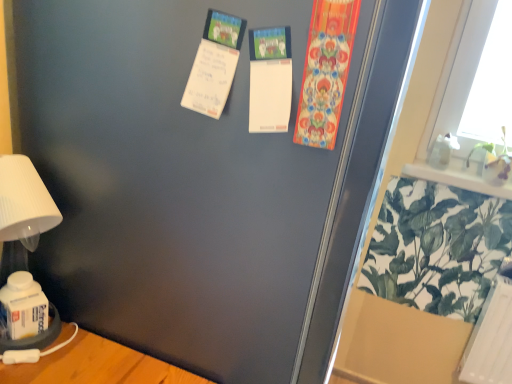
Describe the element at coordinates (437, 247) in the screenshot. The width and height of the screenshot is (512, 384). I see `green leafy plant at lower right, the second plant when ordered from top to bottom` at that location.

The width and height of the screenshot is (512, 384). What do you see at coordinates (326, 71) in the screenshot?
I see `colorful fabric banner at upper right, which is counted as the second postcard, starting from the left` at bounding box center [326, 71].

Find the location of a particular element. Image resolution: width=512 pixels, height=384 pixels. white matte table lamp at lower left is located at coordinates (22, 244).

Find the location of `white paper postcard at upper center, placed as the second postcard when sorted from right to left`. white paper postcard at upper center, placed as the second postcard when sorted from right to left is located at coordinates (210, 79).

Locate an element on the screen. green leafy plant at lower right, the second plant when ordered from top to bottom is located at coordinates (437, 247).

Could you tell me if white paper postcard at upper center, which is the first postcard from left to right, is turned towards green leafy plant at upper right, which appears as the 2th plant when ordered from the bottom?

No, white paper postcard at upper center, which is the first postcard from left to right, is not facing towards green leafy plant at upper right, which appears as the 2th plant when ordered from the bottom.

Based on their sizes in the image, would you say white paper postcard at upper center, placed as the second postcard when sorted from right to left, is bigger or smaller than green leafy plant at upper right, which appears as the 2th plant when ordered from the bottom?

Clearly, white paper postcard at upper center, placed as the second postcard when sorted from right to left, is smaller in size than green leafy plant at upper right, which appears as the 2th plant when ordered from the bottom.

Identify the location of the 2nd plant to the right of the white paper postcard at upper center, placed as the second postcard when sorted from right to left, starting your count from the anchor. (494, 161).

Is point (220, 105) farther from camera compared to point (490, 157)?

That is False.

Is point (349, 54) positioned in front of point (42, 181)?

That is True.

From a real-world perspective, which postcard is the 2nd one above the white matte table lamp at lower left? Please provide its 2D coordinates.

[(326, 71)]

Between colorful fabric banner at upper right, which ranks as the first postcard in right-to-left order, and white matte table lamp at lower left, which one has smaller size?

colorful fabric banner at upper right, which ranks as the first postcard in right-to-left order, is smaller.

From a real-world perspective, is colorful fabric banner at upper right, which ranks as the first postcard in right-to-left order, located higher than white matte table lamp at lower left?

Yes.

Is white matte table lamp at lower left turned away from green leafy plant at upper right, which ranks as the 1th plant in top-to-bottom order?

No.

Are white matte table lamp at lower left and green leafy plant at upper right, which ranks as the 1th plant in top-to-bottom order, making contact?

white matte table lamp at lower left and green leafy plant at upper right, which ranks as the 1th plant in top-to-bottom order, are not in contact.

Considering the sizes of white matte table lamp at lower left and green leafy plant at upper right, which appears as the 2th plant when ordered from the bottom, in the image, is white matte table lamp at lower left taller or shorter than green leafy plant at upper right, which appears as the 2th plant when ordered from the bottom,?

Considering their sizes, white matte table lamp at lower left has more height than green leafy plant at upper right, which appears as the 2th plant when ordered from the bottom.

Does point (49, 203) come in front of point (503, 160)?

Yes, it is.

Is green leafy plant at upper right, which ranks as the 1th plant in top-to-bottom order, positioned with its back to green leafy plant at lower right, the first plant when ordered from bottom to top?

No, green leafy plant at upper right, which ranks as the 1th plant in top-to-bottom order, is not facing the opposite direction of green leafy plant at lower right, the first plant when ordered from bottom to top.

Would you say green leafy plant at upper right, which ranks as the 1th plant in top-to-bottom order, is a long distance from green leafy plant at lower right, the first plant when ordered from bottom to top?

Actually, green leafy plant at upper right, which ranks as the 1th plant in top-to-bottom order, and green leafy plant at lower right, the first plant when ordered from bottom to top, are a little close together.

In the scene shown: Considering the relative sizes of green leafy plant at upper right, which appears as the 2th plant when ordered from the bottom, and green leafy plant at lower right, the first plant when ordered from bottom to top, in the image provided, is green leafy plant at upper right, which appears as the 2th plant when ordered from the bottom, smaller than green leafy plant at lower right, the first plant when ordered from bottom to top,?

Correct, green leafy plant at upper right, which appears as the 2th plant when ordered from the bottom, occupies less space than green leafy plant at lower right, the first plant when ordered from bottom to top.

Is green leafy plant at upper right, which appears as the 2th plant when ordered from the bottom, taller or shorter than green leafy plant at lower right, the second plant when ordered from top to bottom?

In the image, green leafy plant at upper right, which appears as the 2th plant when ordered from the bottom, appears to be shorter than green leafy plant at lower right, the second plant when ordered from top to bottom.

Does point (185, 89) appear closer or farther from the camera than point (452, 243)?

Point (185, 89) is positioned closer to the camera compared to point (452, 243).

Is white paper postcard at upper center, placed as the second postcard when sorted from right to left, next to green leafy plant at lower right, the first plant when ordered from bottom to top?

No, white paper postcard at upper center, placed as the second postcard when sorted from right to left, is not in contact with green leafy plant at lower right, the first plant when ordered from bottom to top.

Looking at this image, is transparent plastic screen door at upper right facing away from colorful fabric banner at upper right, which ranks as the first postcard in right-to-left order?

That's not correct — transparent plastic screen door at upper right is not looking away from colorful fabric banner at upper right, which ranks as the first postcard in right-to-left order.

From a real-world perspective, is transparent plastic screen door at upper right located higher than colorful fabric banner at upper right, which is counted as the second postcard, starting from the left?

Incorrect, from a real-world perspective, transparent plastic screen door at upper right is lower than colorful fabric banner at upper right, which is counted as the second postcard, starting from the left.

What's the angular difference between transparent plastic screen door at upper right and colorful fabric banner at upper right, which is counted as the second postcard, starting from the left,'s facing directions?

90.5 degrees separate the facing orientations of transparent plastic screen door at upper right and colorful fabric banner at upper right, which is counted as the second postcard, starting from the left.

Between transparent plastic screen door at upper right and colorful fabric banner at upper right, which ranks as the first postcard in right-to-left order, which one is positioned behind?

Positioned behind is colorful fabric banner at upper right, which ranks as the first postcard in right-to-left order.

Consider the image. From the image's perspective, is white paper postcard at upper center, which is the first postcard from left to right, under colorful fabric banner at upper right, which is counted as the second postcard, starting from the left?

No, from the image's perspective, white paper postcard at upper center, which is the first postcard from left to right, is not beneath colorful fabric banner at upper right, which is counted as the second postcard, starting from the left.

Considering the sizes of white paper postcard at upper center, placed as the second postcard when sorted from right to left, and colorful fabric banner at upper right, which ranks as the first postcard in right-to-left order, in the image, is white paper postcard at upper center, placed as the second postcard when sorted from right to left, bigger or smaller than colorful fabric banner at upper right, which ranks as the first postcard in right-to-left order,?

Clearly, white paper postcard at upper center, placed as the second postcard when sorted from right to left, is larger in size than colorful fabric banner at upper right, which ranks as the first postcard in right-to-left order.

Who is taller, white paper postcard at upper center, which is the first postcard from left to right, or colorful fabric banner at upper right, which ranks as the first postcard in right-to-left order?

colorful fabric banner at upper right, which ranks as the first postcard in right-to-left order.

Is white paper postcard at upper center, which is the first postcard from left to right, in front of or behind colorful fabric banner at upper right, which is counted as the second postcard, starting from the left, in the image?

white paper postcard at upper center, which is the first postcard from left to right, is positioned farther from the viewer than colorful fabric banner at upper right, which is counted as the second postcard, starting from the left.

From a real-world perspective, count 1st plants downward from the white paper postcard at upper center, which is the first postcard from left to right, and point to it. Please provide its 2D coordinates.

[(494, 161)]

What are the coordinates of `table lamp on the left of colorful fabric banner at upper right, which is counted as the second postcard, starting from the left` in the screenshot? It's located at (22, 244).

Estimate the real-world distances between objects in this image. Which object is closer to transparent plastic screen door at upper right, green leafy plant at upper right, which ranks as the 1th plant in top-to-bottom order, or green leafy plant at lower right, the first plant when ordered from bottom to top?

green leafy plant at lower right, the first plant when ordered from bottom to top, is closer to transparent plastic screen door at upper right.

Estimate the real-world distances between objects in this image. Which object is closer to white paper postcard at upper center, which is the first postcard from left to right, green leafy plant at upper right, which appears as the 2th plant when ordered from the bottom, or white matte table lamp at lower left?

Among the two, white matte table lamp at lower left is located nearer to white paper postcard at upper center, which is the first postcard from left to right.

Which object lies nearer to the anchor point green leafy plant at upper right, which appears as the 2th plant when ordered from the bottom, white paper postcard at upper center, placed as the second postcard when sorted from right to left, or green leafy plant at lower right, the second plant when ordered from top to bottom?

green leafy plant at lower right, the second plant when ordered from top to bottom, lies closer to green leafy plant at upper right, which appears as the 2th plant when ordered from the bottom, than the other object.

Estimate the real-world distances between objects in this image. Which object is closer to white matte table lamp at lower left, green leafy plant at upper right, which appears as the 2th plant when ordered from the bottom, or transparent plastic screen door at upper right?

transparent plastic screen door at upper right is positioned closer to the anchor white matte table lamp at lower left.

Considering their positions, is white matte table lamp at lower left positioned closer to white paper postcard at upper center, which is the first postcard from left to right, than colorful fabric banner at upper right, which ranks as the first postcard in right-to-left order?

colorful fabric banner at upper right, which ranks as the first postcard in right-to-left order.

Based on their spatial positions, is transparent plastic screen door at upper right or green leafy plant at lower right, the second plant when ordered from top to bottom, closer to white matte table lamp at lower left?

Among the two, transparent plastic screen door at upper right is located nearer to white matte table lamp at lower left.

In the scene shown: Estimate the real-world distances between objects in this image. Which object is closer to green leafy plant at upper right, which appears as the 2th plant when ordered from the bottom, white paper postcard at upper center, which is the first postcard from left to right, or transparent plastic screen door at upper right?

Based on the image, white paper postcard at upper center, which is the first postcard from left to right, appears to be nearer to green leafy plant at upper right, which appears as the 2th plant when ordered from the bottom.

Looking at the image, which one is located further to green leafy plant at upper right, which appears as the 2th plant when ordered from the bottom, transparent plastic screen door at upper right or white matte table lamp at lower left?

The object further to green leafy plant at upper right, which appears as the 2th plant when ordered from the bottom, is white matte table lamp at lower left.

The height and width of the screenshot is (384, 512). I want to click on screen door between white matte table lamp at lower left and green leafy plant at lower right, the second plant when ordered from top to bottom, from left to right, so click(x=173, y=183).

Where is `plant between colorful fabric banner at upper right, which is counted as the second postcard, starting from the left, and green leafy plant at lower right, the second plant when ordered from top to bottom, in the front-back direction`? plant between colorful fabric banner at upper right, which is counted as the second postcard, starting from the left, and green leafy plant at lower right, the second plant when ordered from top to bottom, in the front-back direction is located at coordinates (494, 161).

The height and width of the screenshot is (384, 512). In order to click on postcard between colorful fabric banner at upper right, which is counted as the second postcard, starting from the left, and green leafy plant at lower right, the second plant when ordered from top to bottom, in the front-back direction in this screenshot , I will do `click(210, 79)`.

This screenshot has height=384, width=512. Find the location of `screen door located between white paper postcard at upper center, placed as the second postcard when sorted from right to left, and green leafy plant at upper right, which ranks as the 1th plant in top-to-bottom order, in the left-right direction`. screen door located between white paper postcard at upper center, placed as the second postcard when sorted from right to left, and green leafy plant at upper right, which ranks as the 1th plant in top-to-bottom order, in the left-right direction is located at coordinates (173, 183).